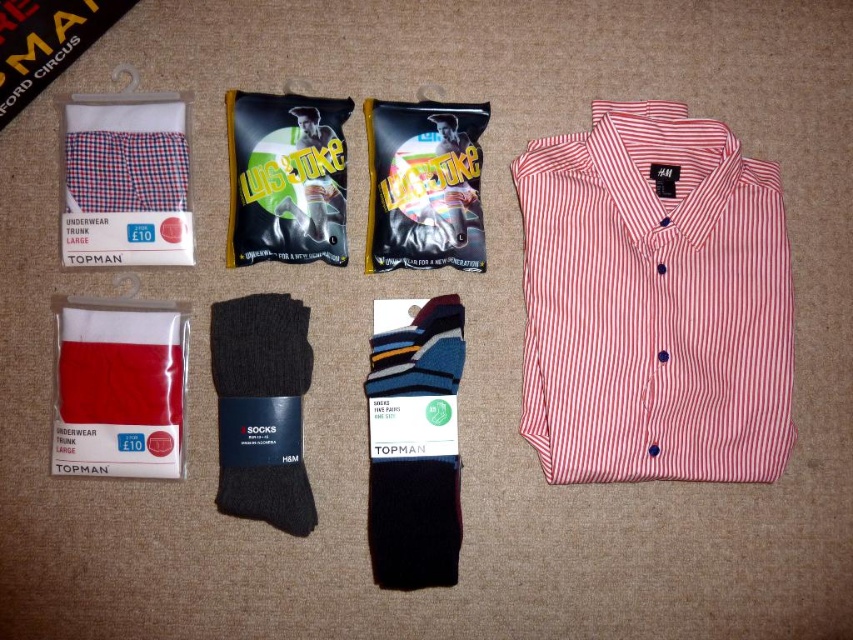
Is striped wool socks at center shorter than black wool socks at center?

No, striped wool socks at center is not shorter than black wool socks at center.

Does striped wool socks at center have a smaller size compared to black wool socks at center?

Incorrect, striped wool socks at center is not smaller in size than black wool socks at center.

Does point (460, 307) come farther from viewer compared to point (271, 307)?

Yes, it is.

Where is `striped wool socks at center`? This screenshot has width=853, height=640. striped wool socks at center is located at coordinates (415, 449).

Can you confirm if red striped cotton shirt at right is smaller than red cotton underwear at lower left?

No, red striped cotton shirt at right is not smaller than red cotton underwear at lower left.

Can you confirm if red striped cotton shirt at right is positioned above red cotton underwear at lower left?

Yes.

Locate an element on the screen. The width and height of the screenshot is (853, 640). red striped cotton shirt at right is located at coordinates (654, 301).

Where is `red striped cotton shirt at right`? The height and width of the screenshot is (640, 853). red striped cotton shirt at right is located at coordinates (654, 301).

Between red striped cotton shirt at right and black wool socks at center, which one appears on the right side from the viewer's perspective?

Positioned to the right is red striped cotton shirt at right.

Does red striped cotton shirt at right have a lesser height compared to black wool socks at center?

No, red striped cotton shirt at right is not shorter than black wool socks at center.

Is point (613, 262) behind point (279, 452)?

Yes, point (613, 262) is behind point (279, 452).

This screenshot has width=853, height=640. I want to click on red striped cotton shirt at right, so pos(654,301).